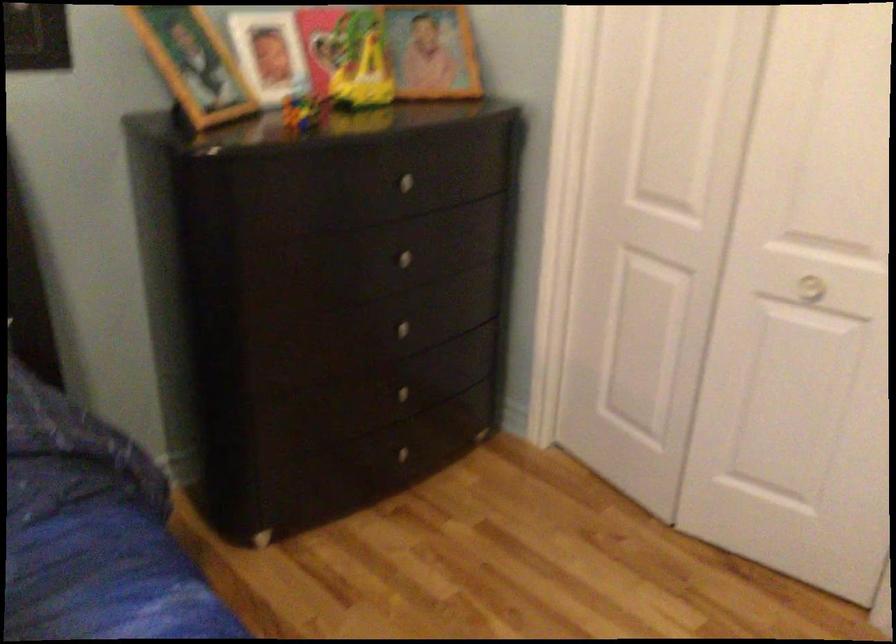
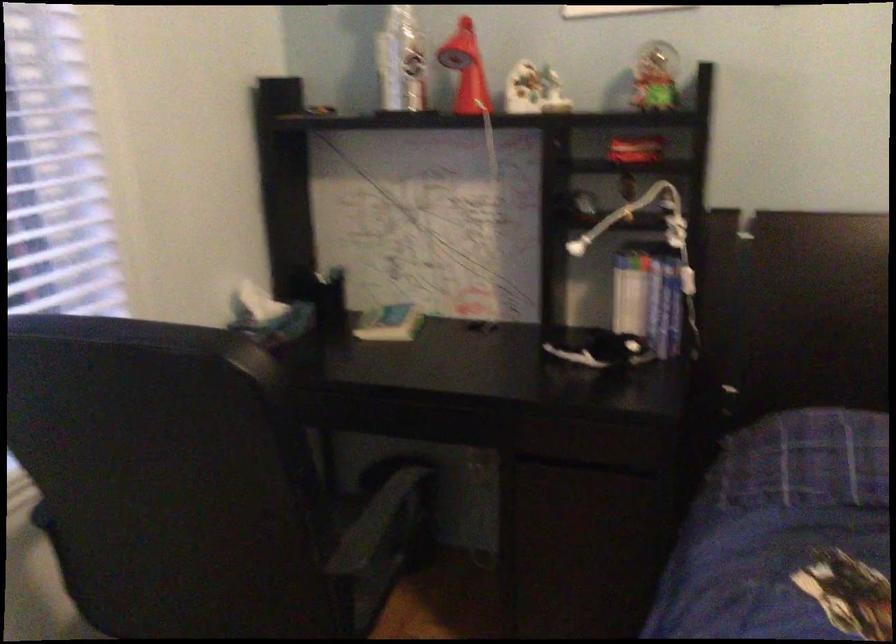
Question: The camera is either moving clockwise (left) or counter-clockwise (right) around the object. The first image is from the beginning of the video and the second image is from the end. Is the camera moving left or right when shooting the video?

Choices:
 (A) Left
 (B) Right

Answer: (B)